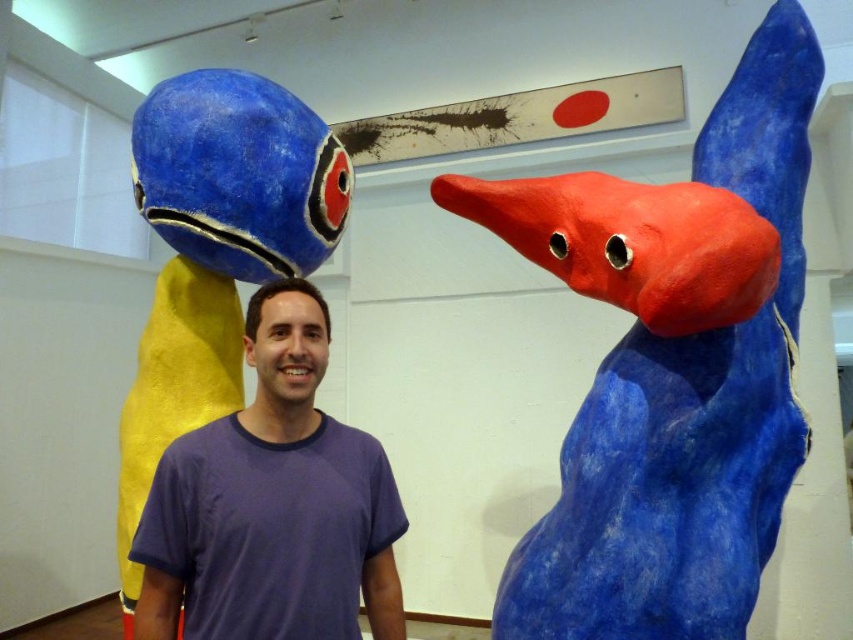
Question: From the image, what is the correct spatial relationship of purple cotton t-shirt at center in relation to matte purple shirt at center?

Choices:
 (A) below
 (B) above

Answer: (A)

Question: Is matte blue sculpture at upper right wider than matte purple shirt at center?

Choices:
 (A) yes
 (B) no

Answer: (A)

Question: Is matte blue sculpture at upper right further to the viewer compared to purple cotton t-shirt at center?

Choices:
 (A) no
 (B) yes

Answer: (B)

Question: Among these points, which one is nearest to the camera?

Choices:
 (A) (312, 602)
 (B) (334, 358)

Answer: (A)

Question: Which point appears closest to the camera in this image?

Choices:
 (A) (666, 572)
 (B) (341, 330)
 (C) (329, 580)

Answer: (C)

Question: Among these objects, which one is nearest to the camera?

Choices:
 (A) matte blue sculpture at upper right
 (B) matte purple shirt at center

Answer: (A)